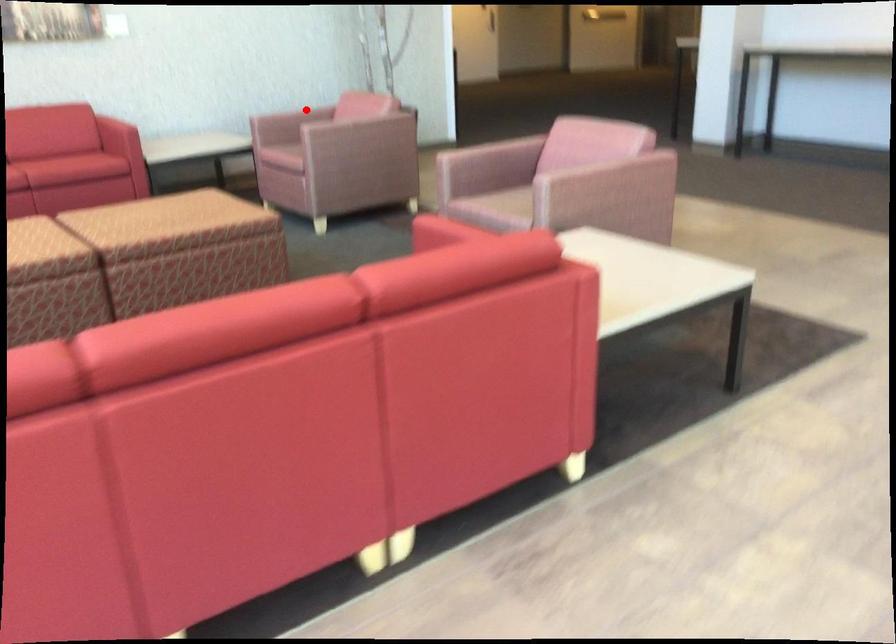
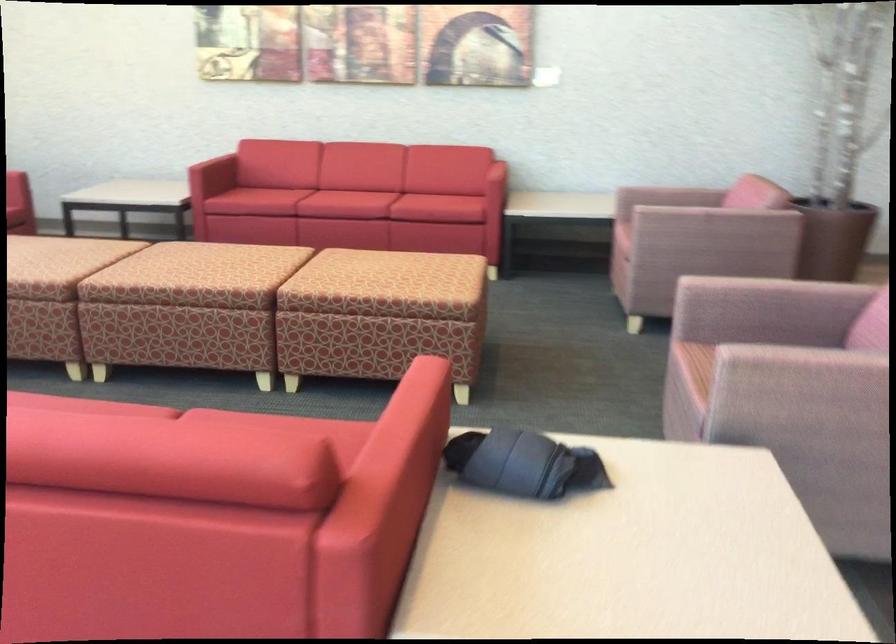
Question: A red point is marked in image1. In image2, is the corresponding 3D point closer to the camera or farther? Reply with the corresponding letter.

Choices:
 (A) The corresponding 3D point is closer.
 (B) The corresponding 3D point is farther.

Answer: (A)